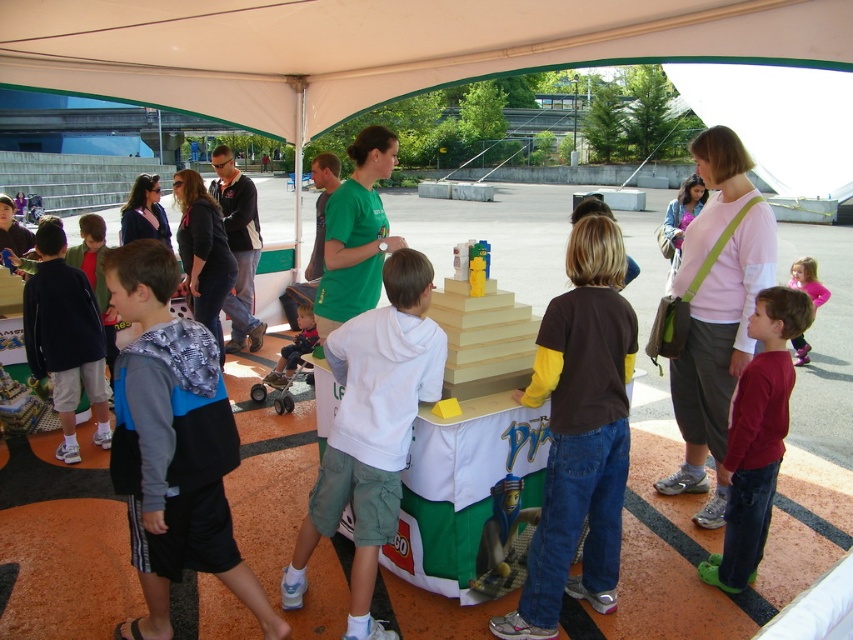
Question: Considering the real-world distances, which object is farthest from the matte black jacket at center?

Choices:
 (A) blue/grey fabric shirt at center
 (B) transparent fabric canopy at upper center
 (C) maroon long-sleeve shirt at lower right
 (D) yellow plastic blocks at center

Answer: (B)

Question: Is brown/yellow long-sleeve shirt at center wider than dark blue hoodie at left?

Choices:
 (A) no
 (B) yes

Answer: (A)

Question: Which of these objects is positioned farthest from the matte black hoodie at center?

Choices:
 (A) blue/grey fabric shirt at center
 (B) brown/yellow long-sleeve shirt at center
 (C) transparent fabric canopy at upper center
 (D) patterned fabric jacket at center

Answer: (C)

Question: Can you confirm if blue/grey fabric shirt at center is positioned above pink fabric shirt at center?

Choices:
 (A) no
 (B) yes

Answer: (A)

Question: Which point appears closest to the camera in this image?

Choices:
 (A) (372, 573)
 (B) (463, 388)
 (C) (793, 266)
 (D) (142, 188)

Answer: (A)

Question: Is white cotton hoodie at center to the right of maroon long-sleeve shirt at lower right from the viewer's perspective?

Choices:
 (A) no
 (B) yes

Answer: (A)